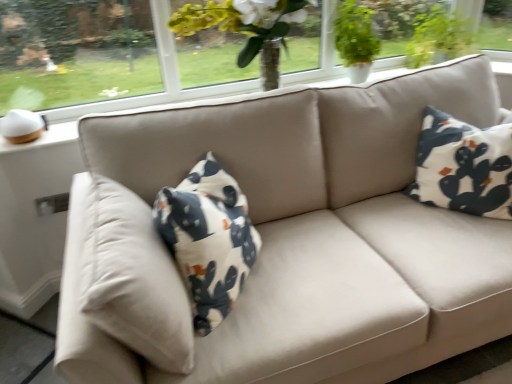
Question: From the image's perspective, does transparent glass window at upper left appear lower than green matte plant at upper right?

Choices:
 (A) no
 (B) yes

Answer: (B)

Question: From a real-world perspective, is transparent glass window at upper left physically below green matte plant at upper right?

Choices:
 (A) yes
 (B) no

Answer: (B)

Question: Is transparent glass window at upper left shorter than green matte plant at upper right?

Choices:
 (A) yes
 (B) no

Answer: (B)

Question: Is transparent glass window at upper left facing towards green matte plant at upper right?

Choices:
 (A) yes
 (B) no

Answer: (B)

Question: Is the depth of transparent glass window at upper left less than that of green matte plant at upper right?

Choices:
 (A) no
 (B) yes

Answer: (B)

Question: Considering the positions of green matte plant at upper right and transparent glass window at upper left in the image, is green matte plant at upper right wider or thinner than transparent glass window at upper left?

Choices:
 (A) thin
 (B) wide

Answer: (B)

Question: Relative to transparent glass window at upper left, is green matte plant at upper right in front or behind?

Choices:
 (A) behind
 (B) front

Answer: (A)

Question: Considering the positions of green matte plant at upper right and transparent glass window at upper left in the image, is green matte plant at upper right bigger or smaller than transparent glass window at upper left?

Choices:
 (A) small
 (B) big

Answer: (B)

Question: Is green matte plant at upper right taller or shorter than transparent glass window at upper left?

Choices:
 (A) tall
 (B) short

Answer: (B)

Question: Is transparent glass window at upper left in front of or behind green matte plant at upper right in the image?

Choices:
 (A) behind
 (B) front

Answer: (B)

Question: Considering the positions of transparent glass window at upper left and green matte plant at upper right in the image, is transparent glass window at upper left wider or thinner than green matte plant at upper right?

Choices:
 (A) wide
 (B) thin

Answer: (B)

Question: From their relative heights in the image, would you say transparent glass window at upper left is taller or shorter than green matte plant at upper right?

Choices:
 (A) tall
 (B) short

Answer: (A)

Question: Is point (129, 62) positioned closer to the camera than point (371, 56)?

Choices:
 (A) farther
 (B) closer

Answer: (B)

Question: Relative to green matte plant at upper right, is white cotton pillow at right in front or behind?

Choices:
 (A) front
 (B) behind

Answer: (A)

Question: Is white cotton pillow at right taller or shorter than green matte plant at upper right?

Choices:
 (A) short
 (B) tall

Answer: (B)